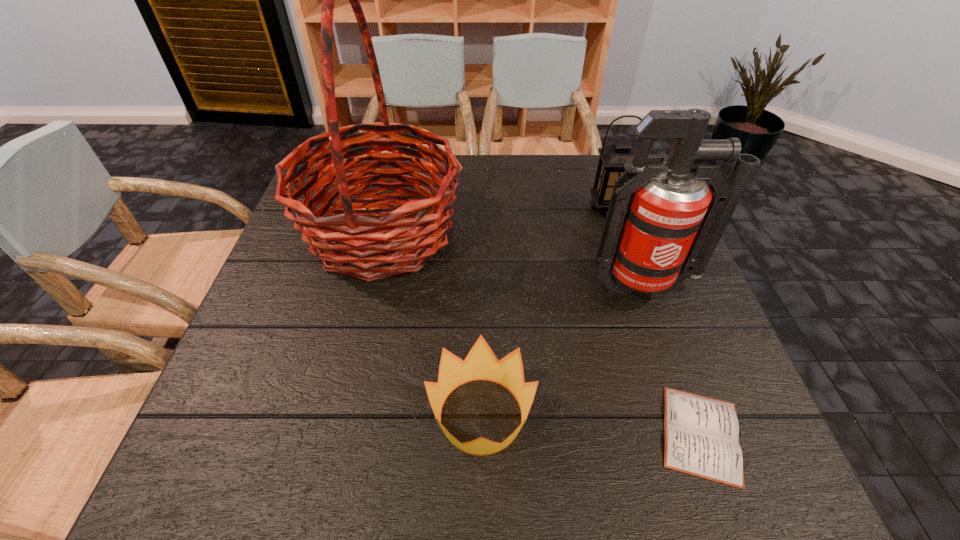
This screenshot has height=540, width=960. In order to click on object that is positioned at the near right corner in this screenshot , I will do `click(701, 434)`.

This screenshot has height=540, width=960. What are the coordinates of `free space at the far edge of the desktop` in the screenshot? It's located at point(555,173).

The image size is (960, 540). In order to click on free space at the near edge in this screenshot , I will do `click(497, 491)`.

Identify the location of free space at the left edge of the desktop. (300, 253).

Where is `blank space at the right edge of the desktop`? The image size is (960, 540). blank space at the right edge of the desktop is located at coordinates (707, 338).

Find the location of a particular element. vacant space that's between the shortest object and the fire extinguisher is located at coordinates (673, 360).

Locate an element on the screen. free space that is in between the crown and the third shortest object is located at coordinates (544, 312).

Locate an element on the screen. free spot between the second tallest object and the tallest object is located at coordinates (513, 259).

Image resolution: width=960 pixels, height=540 pixels. What are the coordinates of `free space between the crown and the lantern` in the screenshot? It's located at (544, 312).

Find the location of a particular element. The width and height of the screenshot is (960, 540). free area in between the shortest object and the second shortest object is located at coordinates (591, 425).